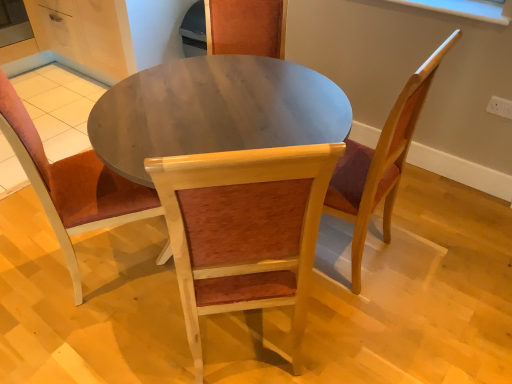
This screenshot has height=384, width=512. Identify the location of free location in front of wooden chair with cushion at center, acting as the third chair starting from the left. (372, 331).